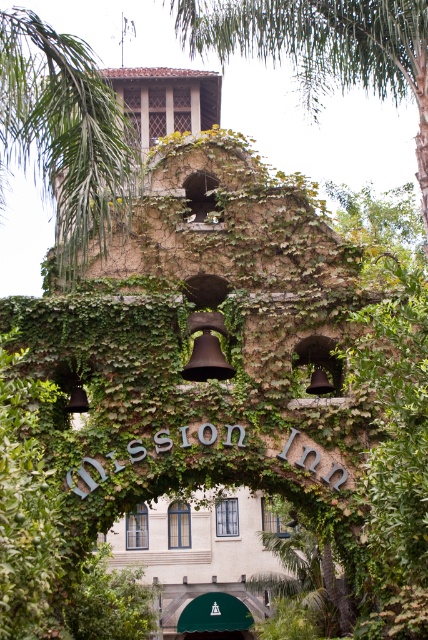
Question: Which of the following is the farthest from the observer?

Choices:
 (A) green leafy palm tree at upper center
 (B) green leafy palm tree at upper left

Answer: (A)

Question: Does green leafy palm tree at upper left appear on the right side of green leafy palm tree at upper center?

Choices:
 (A) yes
 (B) no

Answer: (B)

Question: Which point is closer to the camera?

Choices:
 (A) (56, 168)
 (B) (177, 29)

Answer: (A)

Question: Does green leafy palm tree at upper left appear under green leafy palm tree at upper center?

Choices:
 (A) yes
 (B) no

Answer: (A)

Question: Is green leafy palm tree at upper left smaller than green leafy palm tree at upper center?

Choices:
 (A) no
 (B) yes

Answer: (A)

Question: Which object is farther from the camera taking this photo?

Choices:
 (A) green leafy palm tree at upper center
 (B) green leafy palm tree at upper left

Answer: (A)